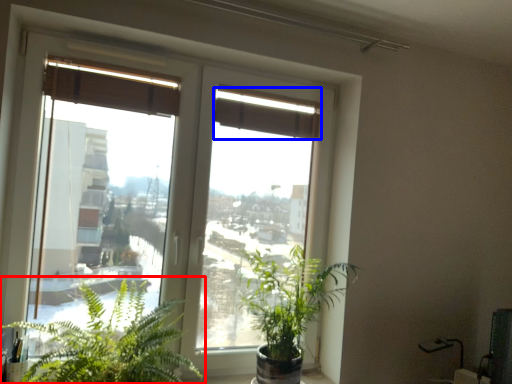
Question: Which of the following is the closest to the observer, houseplant (highlighted by a red box) or curtain (highlighted by a blue box)?

Choices:
 (A) houseplant
 (B) curtain

Answer: (A)